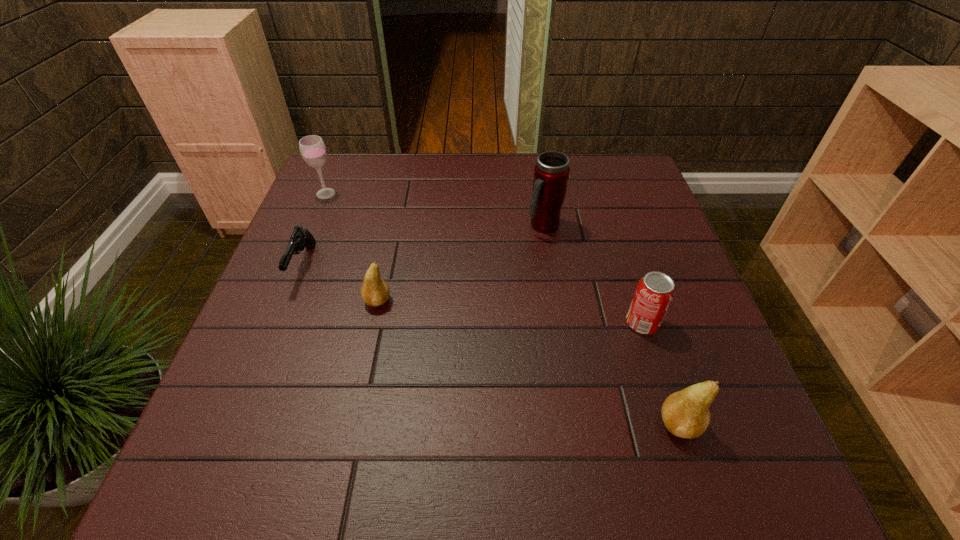
The height and width of the screenshot is (540, 960). Find the location of `pear that is at the right edge`. pear that is at the right edge is located at coordinates (686, 414).

Where is `soda can at the right edge`? soda can at the right edge is located at coordinates (655, 291).

Locate an element on the screen. Image resolution: width=960 pixels, height=540 pixels. object positioned at the far left corner is located at coordinates tap(312, 148).

This screenshot has width=960, height=540. I want to click on object that is at the near right corner, so click(686, 414).

Identify the location of free location at the far edge. This screenshot has width=960, height=540. (491, 167).

You are a GUI agent. You are given a task and a screenshot of the screen. Output one action in this format:
    pyautogui.click(x=<x>, y=<y>)
    Task: Click on the free location at the near edge of the desktop
    
    Given the screenshot: What is the action you would take?
    pyautogui.click(x=332, y=399)

You are a GUI agent. You are given a task and a screenshot of the screen. Output one action in this format:
    pyautogui.click(x=<x>, y=<y>)
    Task: Click on the vacant area at the left edge
    This screenshot has height=540, width=960.
    Given the screenshot: What is the action you would take?
    pyautogui.click(x=259, y=343)

In the image, there is a desktop. Find the location of `vacant area at the right edge`. vacant area at the right edge is located at coordinates (623, 268).

Where is `vacant space at the far left corner`? The image size is (960, 540). vacant space at the far left corner is located at coordinates click(x=364, y=172).

The image size is (960, 540). Find the location of `free spot between the fifth shortest object and the shorter pear`. free spot between the fifth shortest object and the shorter pear is located at coordinates (351, 247).